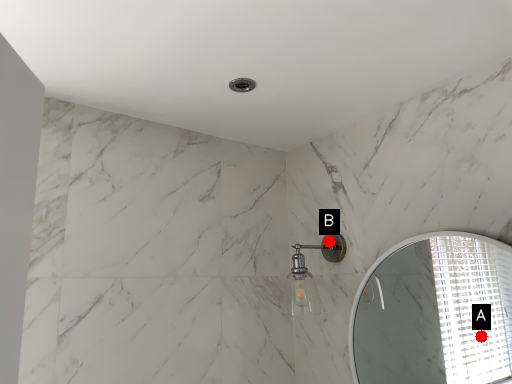
Question: Two points are circled on the image, labeled by A and B beside each circle. Which point is further to the camera?

Choices:
 (A) A is further
 (B) B is further

Answer: (A)